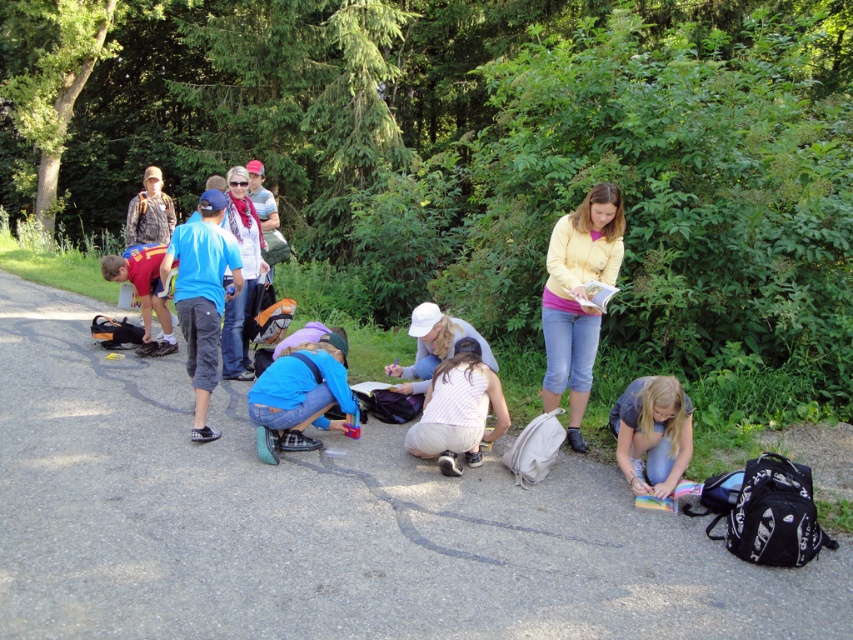
Does light yellow sweater at center have a lesser height compared to matte red shirt at lower left?

Incorrect, light yellow sweater at center's height does not fall short of matte red shirt at lower left's.

Is point (572, 403) in front of point (164, 244)?

Yes, it is.

Locate an element on the screen. The height and width of the screenshot is (640, 853). light yellow sweater at center is located at coordinates coord(577,298).

At what (x,y) coordinates should I click in order to perform the action: click on blue denim jeans at center. Please return your answer as a coordinate pair (x, y). The image size is (853, 640). Looking at the image, I should click on (300, 396).

Can you confirm if blue denim jeans at center is taller than white striped shirt at center?

Incorrect, blue denim jeans at center's height is not larger of white striped shirt at center's.

Does point (335, 401) lie in front of point (457, 364)?

No, it is behind (457, 364).

Locate an element on the screen. This screenshot has height=640, width=853. blue denim jeans at center is located at coordinates (300, 396).

Does point (428, 406) come closer to viewer compared to point (148, 328)?

Yes, it is in front of point (148, 328).

The width and height of the screenshot is (853, 640). Find the location of `white striped shirt at center`. white striped shirt at center is located at coordinates (457, 410).